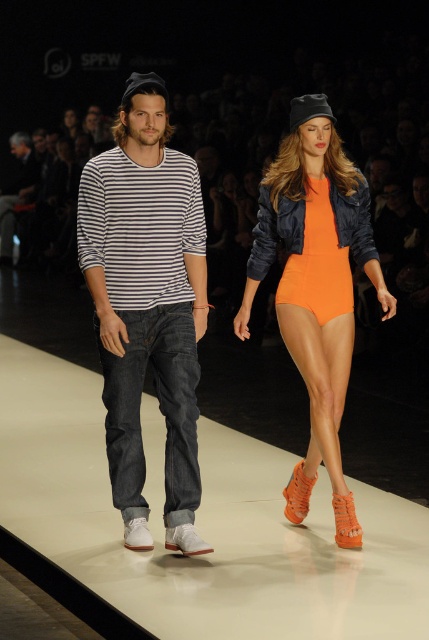
Does striped cotton shirt at center have a lesser width compared to denim jeans at center?

Yes.

What do you see at coordinates (147, 305) in the screenshot?
I see `striped cotton shirt at center` at bounding box center [147, 305].

Who is more distant from viewer, (180, 422) or (24, 193)?

The point (24, 193) is behind.

Image resolution: width=429 pixels, height=640 pixels. Identify the location of striped cotton shirt at center. (147, 305).

Can you confirm if orange matte bodysuit at center is positioned above denim jeans at center?

No.

Which is more to the right, orange matte bodysuit at center or denim jeans at center?

Positioned to the right is orange matte bodysuit at center.

Is point (283, 337) in front of point (11, 212)?

Yes, it is in front of point (11, 212).

Where is `orange matte bodysuit at center`? The width and height of the screenshot is (429, 640). orange matte bodysuit at center is located at coordinates (316, 285).

Does striped cotton shirt at center appear on the right side of orange matte bodysuit at center?

Incorrect, striped cotton shirt at center is not on the right side of orange matte bodysuit at center.

Which of these two, striped cotton shirt at center or orange matte bodysuit at center, stands taller?

striped cotton shirt at center

Does point (199, 301) come behind point (269, 202)?

That is False.

Locate an element on the screen. This screenshot has width=429, height=640. striped cotton shirt at center is located at coordinates (147, 305).